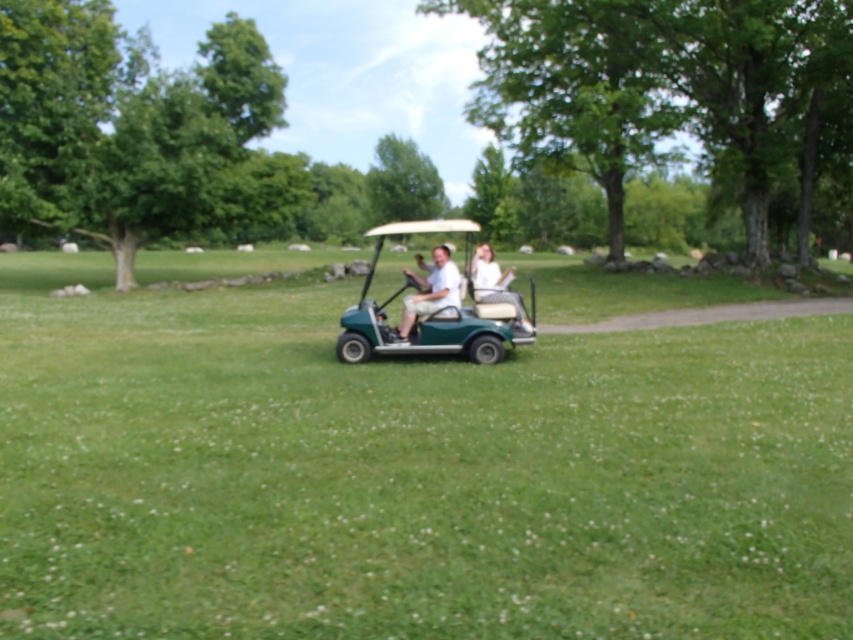
Which is more to the left, white matte golf cart at center or white fabric shirt at center?

white matte golf cart at center is more to the left.

Which is behind, point (427, 310) or point (519, 300)?

Positioned behind is point (427, 310).

I want to click on white matte golf cart at center, so click(428, 292).

Where is `white matte golf cart at center`? This screenshot has width=853, height=640. white matte golf cart at center is located at coordinates (428, 292).

Is white matte golf cart at center thinner than matte green golf cart at center?

Indeed, white matte golf cart at center has a lesser width compared to matte green golf cart at center.

Who is shorter, white matte golf cart at center or matte green golf cart at center?

white matte golf cart at center is shorter.

Where is `white matte golf cart at center`? The image size is (853, 640). white matte golf cart at center is located at coordinates (428, 292).

This screenshot has width=853, height=640. What do you see at coordinates (436, 307) in the screenshot?
I see `green matte golf cart at center` at bounding box center [436, 307].

Is point (438, 276) more distant than point (416, 300)?

That is True.

Which is in front, point (503, 320) or point (503, 296)?

Point (503, 296)

Locate an element on the screen. This screenshot has height=640, width=853. green matte golf cart at center is located at coordinates (436, 307).